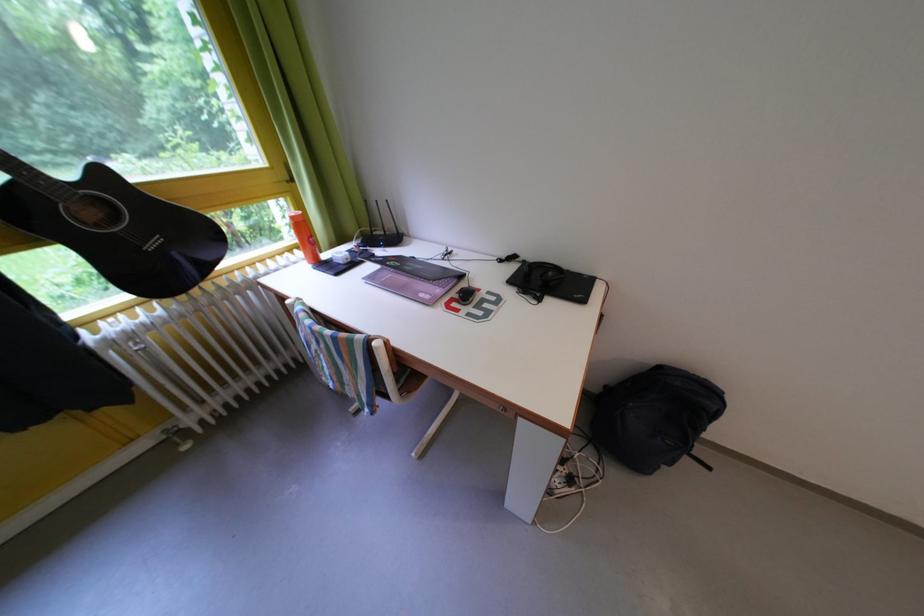
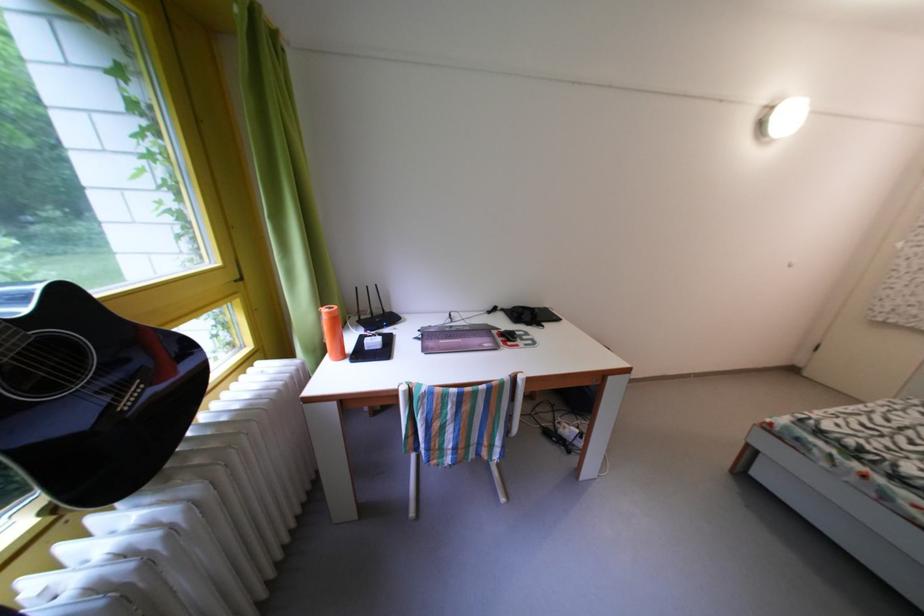
Question: The camera is either moving clockwise (left) or counter-clockwise (right) around the object. The first image is from the beginning of the video and the second image is from the end. Is the camera moving left or right when shooting the video?

Choices:
 (A) Left
 (B) Right

Answer: (A)